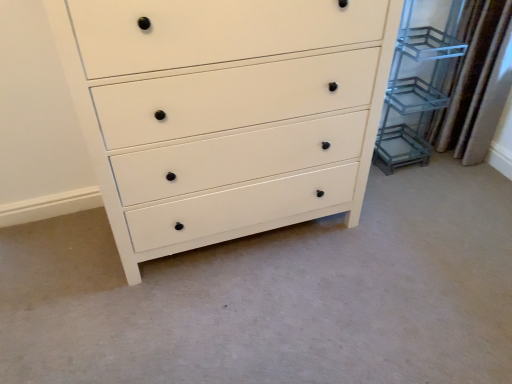
This screenshot has height=384, width=512. Find the location of `space that is in front of brown textured curtain at right`. space that is in front of brown textured curtain at right is located at coordinates (474, 177).